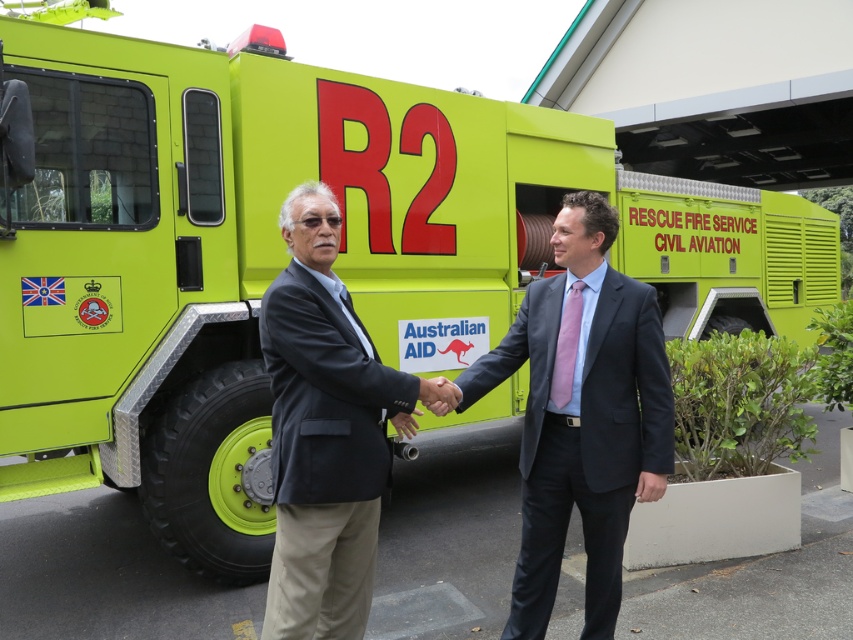
You are a photographer standing 10 feet away from the dark blue suit at center and dark gray suit at center. You want to take a photo that includes both suits in the frame. Given that your camera has a maximum angle of view of 60 degrees, will you be able to capture both suits in a single shot?

The dark blue suit at center is 23.99 inches from dark gray suit at center. At 10 feet away, the distance between them is within the camera angle of 60 degrees, so yes, both suits can be captured in a single shot.

You are a photographer standing at the scene wanting to take a portrait of the dark blue suit at center. Your camera has a minimum focusing distance of 2 meters. Can you take the photo without moving closer?

The dark blue suit at center and viewer are 2.71 meters apart. Since the minimum focusing distance is 2 meters, you can take the photo without moving closer.

You are a photographer at the event and need to position a camera tripod between the dark blue suit at center and the dark gray suit at center. Since the tripod requires a flat surface, which suit is taller so you can place the tripod next to it?

The dark blue suit at center is taller than the dark gray suit at center, so you can place the tripod next to the dark blue suit at center.